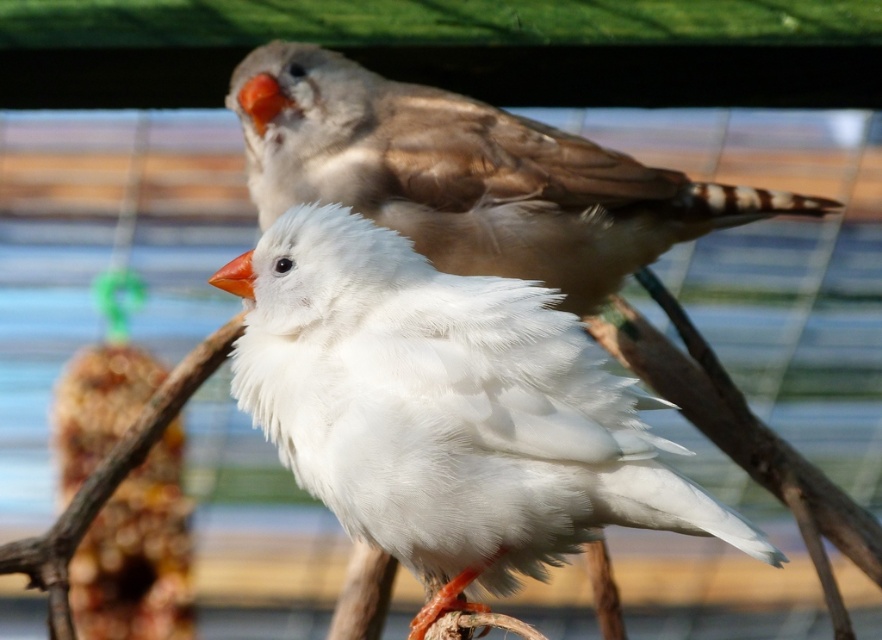
You are a bird enthusiast observing the scene. You notice the white feathered bird at center and the matte brown bird at upper center. Which bird is positioned closer to you?

The white feathered bird at center is closer to the viewer than the matte brown bird at upper center.

You are a small toy drone that is 12 inches wide. You want to fly between the white feathered bird at center and the matte brown bird at upper center to take a photo. Can you fit through the space between them?

The distance between the white feathered bird at center and the matte brown bird at upper center is 23.37 inches. Since the drone is 12 inches wide, it can easily fit through the space between them as the distance is more than double the drone width.

Where is the white feathered bird at center located in the image?

The white feathered bird at center is located at point (447, 410).